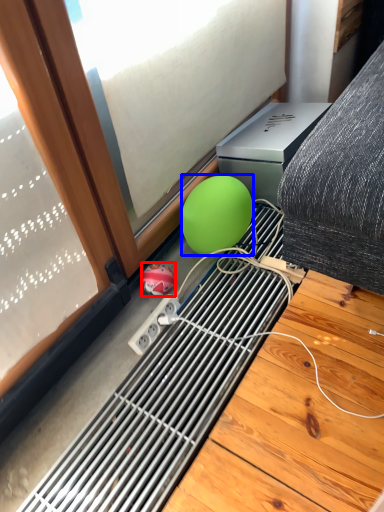
Question: Which object is further to the camera taking this photo, ball (highlighted by a red box) or ball (highlighted by a blue box)?

Choices:
 (A) ball
 (B) ball

Answer: (A)